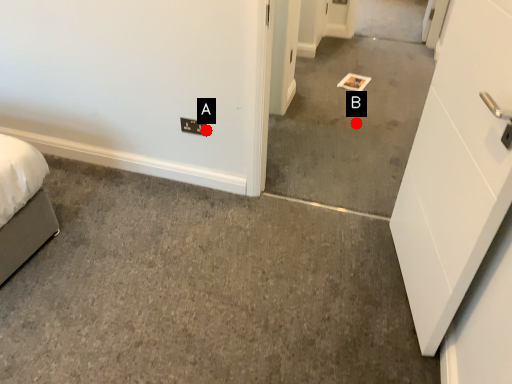
Question: Two points are circled on the image, labeled by A and B beside each circle. Which point appears farthest from the camera in this image?

Choices:
 (A) A is further
 (B) B is further

Answer: (B)